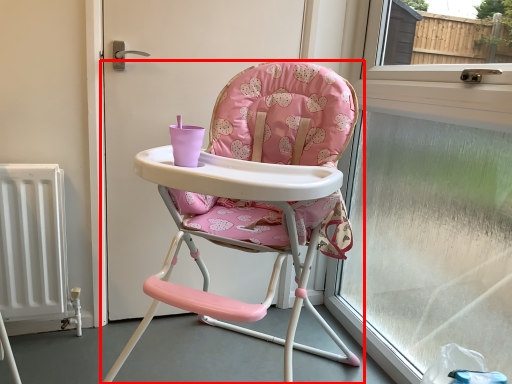
Question: From the image, what is the correct spatial relationship of chair (annotated by the red box) in relation to window frame?

Choices:
 (A) left
 (B) right

Answer: (A)